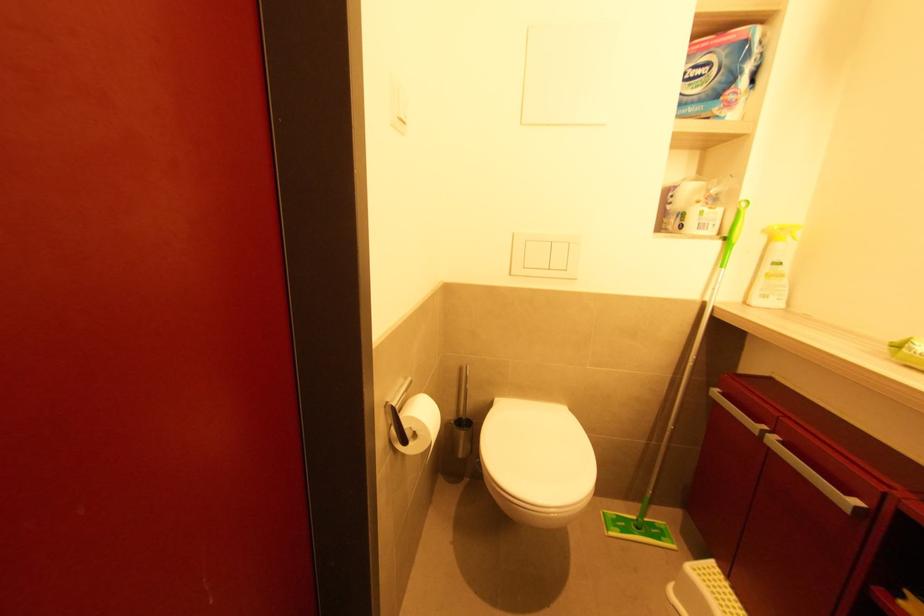
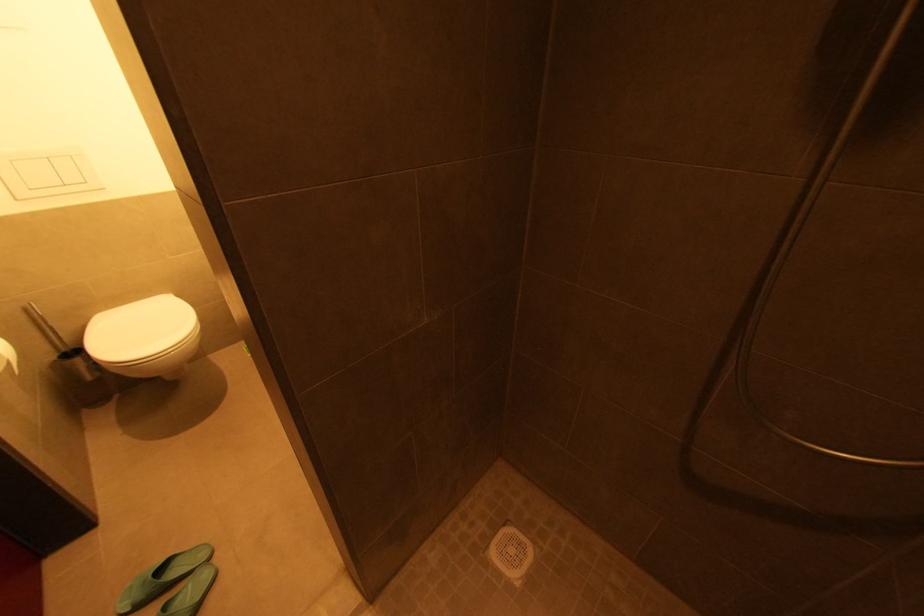
The images are taken continuously from a first-person perspective. In which direction is your viewpoint rotating?

The rotation direction of the camera is right-down.